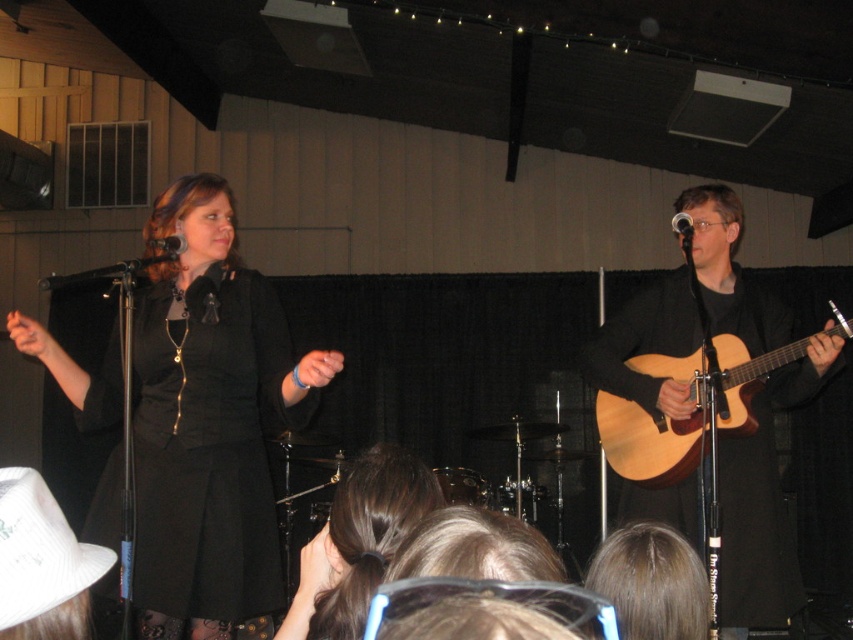
Based on the scene description, can you determine which object is taller between the light brown acoustic guitar at right and the brown hair at center?

The light brown acoustic guitar at right is much taller than the brown hair at center.

You are a photographer in the audience. You want to take a photo of the light brown wood acoustic guitar at right and the white fabric cowboy hat at lower left. Which object should you focus on first if you want to capture both in the same frame without moving your camera?

You should focus on the white fabric cowboy hat at lower left first because it is closer to you than the light brown wood acoustic guitar at right, which is farther away.